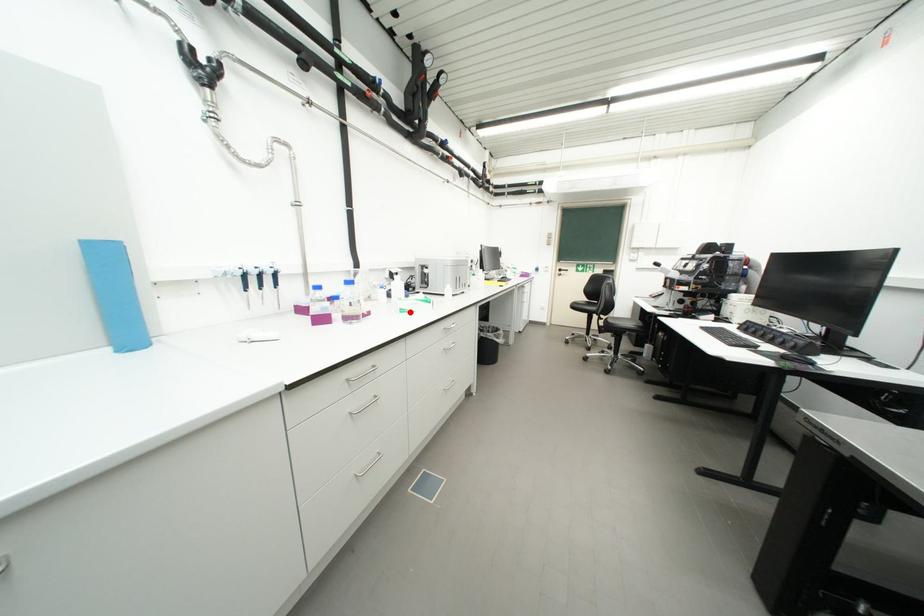
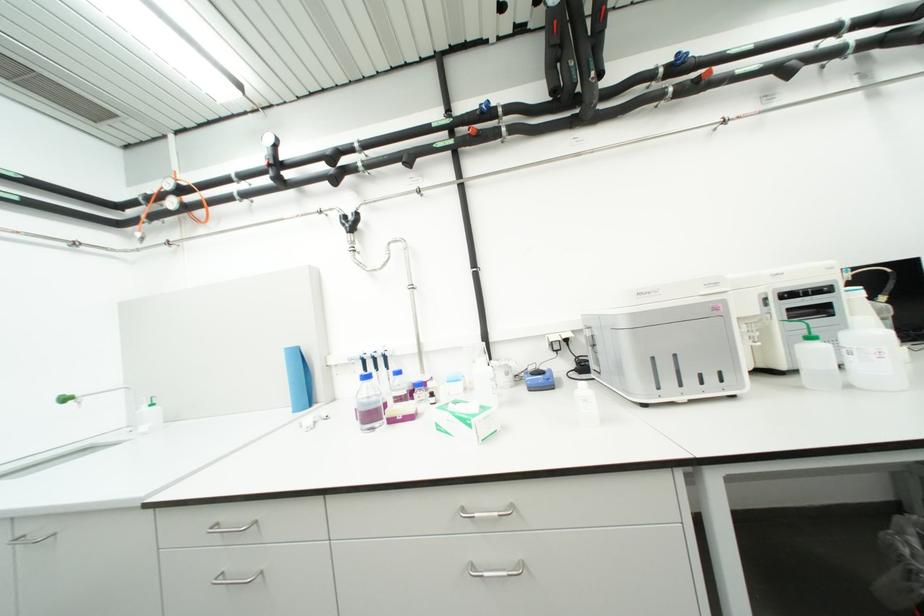
Locate, in the second image, the point that corresponds to the highlighted location in the first image.

(446, 429)